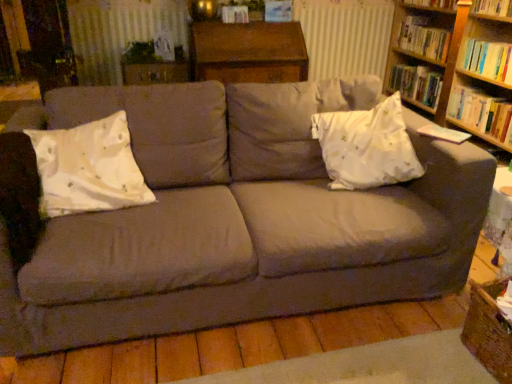
Image resolution: width=512 pixels, height=384 pixels. What do you see at coordinates (489, 60) in the screenshot?
I see `hardcover book at upper right, the second book in the bottom-to-top sequence` at bounding box center [489, 60].

What is the approximate width of wooden bookcase at upper right?

It is 19.27 inches.

Where is `hardcover book at right, acting as the 5th book starting from the top`? The height and width of the screenshot is (384, 512). hardcover book at right, acting as the 5th book starting from the top is located at coordinates (481, 112).

What is the approximate height of velvet gray couch at center?

It is 31.66 inches.

Identify the location of hardcover book at upper right, positioned as the 4th book in top-to-bottom order. (489, 60).

Considering the sizes of hardcover book at upper center and wooden bookcase at upper right in the image, is hardcover book at upper center taller or shorter than wooden bookcase at upper right?

In the image, hardcover book at upper center appears to be shorter than wooden bookcase at upper right.

From a real-world perspective, does hardcover book at upper center stand above wooden bookcase at upper right?

Correct, in the physical world, hardcover book at upper center is higher than wooden bookcase at upper right.

Does hardcover book at upper center have a greater width compared to wooden bookcase at upper right?

In fact, hardcover book at upper center might be narrower than wooden bookcase at upper right.

Considering the relative sizes of hardcover book at upper center and wooden bookcase at upper right in the image provided, is hardcover book at upper center smaller than wooden bookcase at upper right?

Indeed, hardcover book at upper center has a smaller size compared to wooden bookcase at upper right.

Is white satin pillow at right, the 1th throw pillow in the right-to-left sequence, facing towards wooden bookcase at upper right?

No, white satin pillow at right, the 1th throw pillow in the right-to-left sequence, is not aimed at wooden bookcase at upper right.

In terms of size, does white satin pillow at right, the 1th throw pillow in the right-to-left sequence, appear bigger or smaller than wooden bookcase at upper right?

white satin pillow at right, the 1th throw pillow in the right-to-left sequence, is smaller than wooden bookcase at upper right.

Is white satin pillow at right, the 2th throw pillow viewed from the left, completely or partially outside of wooden bookcase at upper right?

Yes, white satin pillow at right, the 2th throw pillow viewed from the left, is not within wooden bookcase at upper right.

Relative to hardcover book at upper right, positioned as the 4th book in top-to-bottom order, is hardcover book at upper right, marked as the 3th book in a bottom-to-top arrangement, in front or behind?

Clearly, hardcover book at upper right, marked as the 3th book in a bottom-to-top arrangement, is behind hardcover book at upper right, positioned as the 4th book in top-to-bottom order.

Between hardcover book at upper right, which is the 3th book in top-to-bottom order, and hardcover book at upper right, positioned as the 4th book in top-to-bottom order, which one has larger width?

hardcover book at upper right, positioned as the 4th book in top-to-bottom order, is wider.

Based on the photo, how much distance is there between hardcover book at upper right, marked as the 3th book in a bottom-to-top arrangement, and hardcover book at upper right, positioned as the 4th book in top-to-bottom order?

A: hardcover book at upper right, marked as the 3th book in a bottom-to-top arrangement, is 43.42 centimeters away from hardcover book at upper right, positioned as the 4th book in top-to-bottom order.

Which object is positioned more to the right, hardcover book at upper right, marked as the 3th book in a bottom-to-top arrangement, or hardcover book at upper right, the second book in the bottom-to-top sequence?

From the viewer's perspective, hardcover book at upper right, the second book in the bottom-to-top sequence, appears more on the right side.

How far apart are hardcover book at upper right, the second book in the bottom-to-top sequence, and hardcover book at upper center?

hardcover book at upper right, the second book in the bottom-to-top sequence, and hardcover book at upper center are 5.03 feet apart.

Identify the location of the 4th book to the right of the hardcover book at upper center, starting your count from the anchor. pos(489,60).

Considering the relative sizes of hardcover book at upper right, the second book in the bottom-to-top sequence, and hardcover book at upper center in the image provided, is hardcover book at upper right, the second book in the bottom-to-top sequence, thinner than hardcover book at upper center?

No.

From a real-world perspective, is hardcover book at upper right, the second book in the bottom-to-top sequence, physically above hardcover book at upper center?

Actually, hardcover book at upper right, the second book in the bottom-to-top sequence, is physically below hardcover book at upper center in the real world.

How different are the orientations of hardcover book at upper right, positioned as the 4th book in bottom-to-top order, and hardcover book at upper center in degrees?

86.5 degrees separate the facing orientations of hardcover book at upper right, positioned as the 4th book in bottom-to-top order, and hardcover book at upper center.

Is hardcover book at upper right, positioned as the 4th book in bottom-to-top order, positioned beyond the bounds of hardcover book at upper center?

That's correct, hardcover book at upper right, positioned as the 4th book in bottom-to-top order, is outside of hardcover book at upper center.

From the image's perspective, which is above, hardcover book at upper right, the 2th book from the top, or hardcover book at upper center?

hardcover book at upper center is shown above in the image.

Is the position of hardcover book at upper right, the 2th book from the top, more distant than that of hardcover book at upper center?

No, it is not.

From the image's perspective, between hardcover book at upper right, which is the 3th book in top-to-bottom order, and hardcover book at upper center, who is located below?

hardcover book at upper right, which is the 3th book in top-to-bottom order, from the image's perspective.

Is point (403, 79) positioned after point (238, 8)?

Yes, it is behind point (238, 8).

From the picture: From a real-world perspective, is hardcover book at upper right, marked as the 3th book in a bottom-to-top arrangement, physically located above or below hardcover book at upper center?

In terms of real-world spatial position, hardcover book at upper right, marked as the 3th book in a bottom-to-top arrangement, is below hardcover book at upper center.

Is hardcover book at upper right, which is the 3th book in top-to-bottom order, to the left or to the right of hardcover book at upper center in the image?

Based on their positions, hardcover book at upper right, which is the 3th book in top-to-bottom order, is located to the right of hardcover book at upper center.

Considering the relative sizes of velvet gray couch at center and hardcover book at upper right, positioned as the 4th book in bottom-to-top order, in the image provided, is velvet gray couch at center bigger than hardcover book at upper right, positioned as the 4th book in bottom-to-top order,?

Indeed, velvet gray couch at center has a larger size compared to hardcover book at upper right, positioned as the 4th book in bottom-to-top order.

Consider the image. Considering the sizes of velvet gray couch at center and hardcover book at upper right, positioned as the 4th book in bottom-to-top order, in the image, is velvet gray couch at center wider or thinner than hardcover book at upper right, positioned as the 4th book in bottom-to-top order,?

Clearly, velvet gray couch at center has more width compared to hardcover book at upper right, positioned as the 4th book in bottom-to-top order.

Based on the photo, is velvet gray couch at center touching hardcover book at upper right, positioned as the 4th book in bottom-to-top order?

No.

This screenshot has height=384, width=512. Identify the location of bookcase below the hardcover book at upper center (from a real-world perspective). pos(456,67).

Where is `bookcase behind the white satin pillow at right, the 1th throw pillow in the right-to-left sequence`? Image resolution: width=512 pixels, height=384 pixels. bookcase behind the white satin pillow at right, the 1th throw pillow in the right-to-left sequence is located at coordinates (456, 67).

From the image, which object appears to be farther from hardcover book at upper right, positioned as the 4th book in top-to-bottom order, white satin pillow at left, which ranks as the 1th throw pillow in left-to-right order, or hardcover book at upper right, which is the 3th book in top-to-bottom order?

Based on the image, white satin pillow at left, which ranks as the 1th throw pillow in left-to-right order, appears to be further to hardcover book at upper right, positioned as the 4th book in top-to-bottom order.

Considering their positions, is wooden dresser at upper center positioned further to hardcover book at upper right, positioned as the 4th book in bottom-to-top order, than wooden bookcase at upper right?

wooden dresser at upper center is further to hardcover book at upper right, positioned as the 4th book in bottom-to-top order.

Considering their positions, is white satin pillow at left, arranged as the second throw pillow when viewed from the right, positioned closer to wooden bookcase at upper right than hardcover book at upper center?

The object closer to wooden bookcase at upper right is hardcover book at upper center.

When comparing their distances from velvet gray couch at center, does wooden dresser at upper center or hardcover book at upper center seem closer?

The object closer to velvet gray couch at center is wooden dresser at upper center.

When comparing their distances from white satin pillow at right, the 2th throw pillow viewed from the left, does hardcover book at right, the first book positioned from the bottom, or white satin pillow at left, arranged as the second throw pillow when viewed from the right, seem closer?

Based on the image, white satin pillow at left, arranged as the second throw pillow when viewed from the right, appears to be nearer to white satin pillow at right, the 2th throw pillow viewed from the left.

Estimate the real-world distances between objects in this image. Which object is further from wooden dresser at upper center, hardcover book at upper right, the second book in the bottom-to-top sequence, or hardcover book at upper right, which ranks as the fifth book in bottom-to-top order?

hardcover book at upper right, the second book in the bottom-to-top sequence, lies further to wooden dresser at upper center than the other object.

Estimate the real-world distances between objects in this image. Which object is further from hardcover book at right, the first book positioned from the bottom, hardcover book at upper center or hardcover book at upper right, which ranks as the fifth book in bottom-to-top order?

The object further to hardcover book at right, the first book positioned from the bottom, is hardcover book at upper center.

Looking at the image, which one is located closer to hardcover book at upper right, positioned as the 4th book in bottom-to-top order, white satin pillow at left, arranged as the second throw pillow when viewed from the right, or wooden bookcase at upper right?

The object closer to hardcover book at upper right, positioned as the 4th book in bottom-to-top order, is wooden bookcase at upper right.

The width and height of the screenshot is (512, 384). Find the location of `dresser located between velvet gray couch at center and hardcover book at right, the first book positioned from the bottom, in the left-right direction`. dresser located between velvet gray couch at center and hardcover book at right, the first book positioned from the bottom, in the left-right direction is located at coordinates (248, 52).

Where is `dresser between hardcover book at upper center and hardcover book at upper right, which is the 3th book in top-to-bottom order, in the horizontal direction`? dresser between hardcover book at upper center and hardcover book at upper right, which is the 3th book in top-to-bottom order, in the horizontal direction is located at coordinates pos(248,52).

At what (x,y) coordinates should I click in order to perform the action: click on dresser located between white satin pillow at left, which ranks as the 1th throw pillow in left-to-right order, and hardcover book at upper right, which ranks as the 1th book in top-to-bottom order, in the left-right direction. Please return your answer as a coordinate pair (x, y). Looking at the image, I should click on (248, 52).

Locate an element on the screen. Image resolution: width=512 pixels, height=384 pixels. dresser located between velvet gray couch at center and hardcover book at upper right, which is the 3th book in top-to-bottom order, in the depth direction is located at coordinates [248, 52].